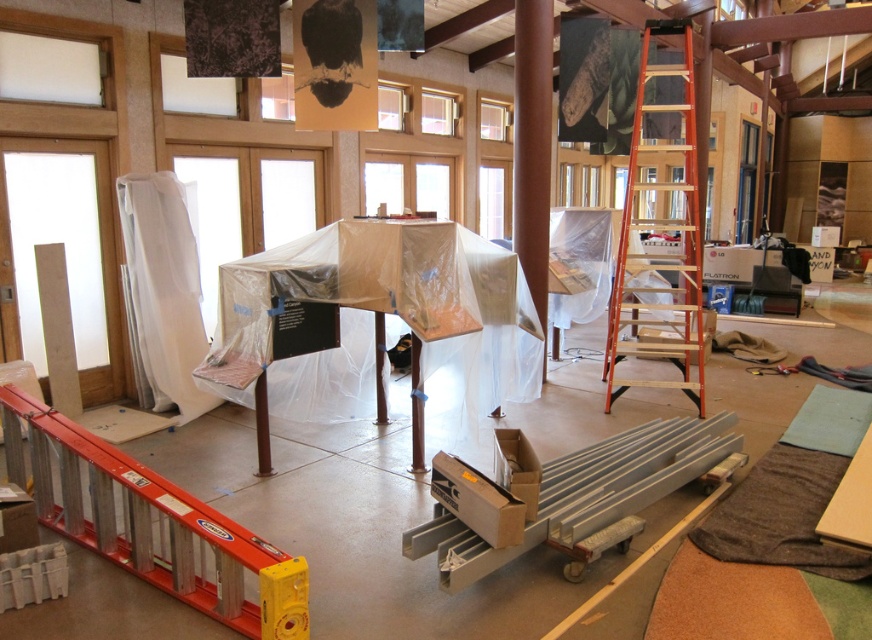
Describe the element at coordinates (153, 524) in the screenshot. The image size is (872, 640). I see `aluminum ladder at lower left` at that location.

Who is more distant from viewer, (19, 461) or (655, 284)?

Positioned behind is point (655, 284).

Between point (160, 486) and point (689, 246), which one is positioned behind?

Positioned behind is point (689, 246).

Locate an element on the screen. This screenshot has height=640, width=872. aluminum ladder at lower left is located at coordinates (153, 524).